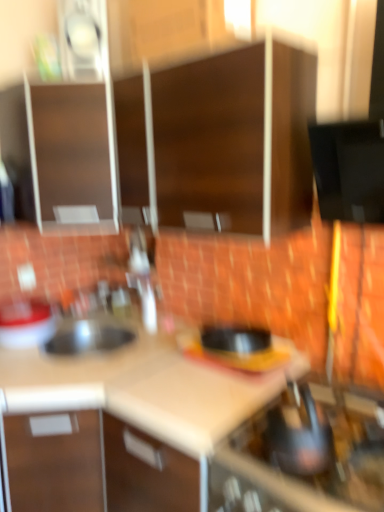
What do you see at coordinates (25, 324) in the screenshot? Image resolution: width=384 pixels, height=512 pixels. I see `matte white sink at left` at bounding box center [25, 324].

Find the location of a particular element. matte white sink at left is located at coordinates (25, 324).

What is the approximate width of beige laminate countertop at center?

It is 1.09 meters.

Describe the element at coordinates (176, 426) in the screenshot. The width and height of the screenshot is (384, 512). I see `beige laminate countertop at center` at that location.

Consider the image. What is the approximate width of wooden cabinet at center, which is the third cabinetry from left to right?

wooden cabinet at center, which is the third cabinetry from left to right, is 12.86 inches wide.

The image size is (384, 512). What do you see at coordinates (196, 396) in the screenshot?
I see `beige laminate counter top at center, marked as the 1th counter top in a right-to-left arrangement` at bounding box center [196, 396].

What is the approximate width of matte brown cabinet at upper left, the 1th cabinetry when ordered from left to right?

20.59 inches.

The width and height of the screenshot is (384, 512). What do you see at coordinates (304, 456) in the screenshot?
I see `metallic silver kettle at lower right` at bounding box center [304, 456].

The image size is (384, 512). Find the location of `matte white sink at left`. matte white sink at left is located at coordinates (x=25, y=324).

From a real-world perspective, is beige laminate counter top at center, which appears as the 2th counter top when viewed from the left, beneath matte brown cabinet at upper left, which appears as the third cabinetry when viewed from the right?

Yes.

Which of these two, beige laminate counter top at center, marked as the 1th counter top in a right-to-left arrangement, or matte brown cabinet at upper left, the 1th cabinetry when ordered from left to right, stands shorter?

With less height is matte brown cabinet at upper left, the 1th cabinetry when ordered from left to right.

Is beige laminate counter top at center, which appears as the 2th counter top when viewed from the left, aimed at matte brown cabinet at upper left, which appears as the third cabinetry when viewed from the right?

No, beige laminate counter top at center, which appears as the 2th counter top when viewed from the left, is not facing towards matte brown cabinet at upper left, which appears as the third cabinetry when viewed from the right.

Does beige laminate counter top at center, marked as the 1th counter top in a right-to-left arrangement, have a lesser width compared to matte brown cabinet at upper left, the 1th cabinetry when ordered from left to right?

No, beige laminate counter top at center, marked as the 1th counter top in a right-to-left arrangement, is not thinner than matte brown cabinet at upper left, the 1th cabinetry when ordered from left to right.

Can you confirm if beige laminate counter top at center, which appears as the 2th counter top when viewed from the left, is wider than metallic silver kettle at lower right?

Yes, beige laminate counter top at center, which appears as the 2th counter top when viewed from the left, is wider than metallic silver kettle at lower right.

Is beige laminate counter top at center, which appears as the 2th counter top when viewed from the left, not near metallic silver kettle at lower right?

beige laminate counter top at center, which appears as the 2th counter top when viewed from the left, is actually quite close to metallic silver kettle at lower right.

Is point (266, 388) closer to camera compared to point (340, 399)?

No, it is behind (340, 399).

Is beige laminate countertop at center inside wooden cabinet at center, which is the third cabinetry from left to right?

No, beige laminate countertop at center is not surrounded by wooden cabinet at center, which is the third cabinetry from left to right.

Is wooden cabinet at center, which is the third cabinetry from left to right, far from beige laminate countertop at center?

wooden cabinet at center, which is the third cabinetry from left to right, is actually quite close to beige laminate countertop at center.

From a real-world perspective, is wooden cabinet at center, arranged as the first cabinetry when viewed from the right, above or below beige laminate countertop at center?

wooden cabinet at center, arranged as the first cabinetry when viewed from the right, is situated higher than beige laminate countertop at center in the real world.

Can you confirm if wooden cabinet at center, which is the third cabinetry from left to right, is taller than beige laminate countertop at center?

No, wooden cabinet at center, which is the third cabinetry from left to right, is not taller than beige laminate countertop at center.

Is wooden cabinet at upper center, acting as the second cabinetry starting from the left, closer to camera compared to matte white sink at left?

That is True.

From the image's perspective, between wooden cabinet at upper center, arranged as the 2th cabinetry when viewed from the right, and matte white sink at left, which one is located above?

wooden cabinet at upper center, arranged as the 2th cabinetry when viewed from the right, from the image's perspective.

How different are the orientations of wooden cabinet at upper center, arranged as the 2th cabinetry when viewed from the right, and matte white sink at left in degrees?

90 degrees.

Is wooden cabinet at upper center, acting as the second cabinetry starting from the left, oriented away from matte white sink at left?

No, matte white sink at left is not at the back of wooden cabinet at upper center, acting as the second cabinetry starting from the left.

Could you tell me if beige laminate counter top at center, which appears as the 2th counter top when viewed from the left, is turned towards white matte countertop at center, which appears as the second counter top when viewed from the right?

No, beige laminate counter top at center, which appears as the 2th counter top when viewed from the left, is not aimed at white matte countertop at center, which appears as the second counter top when viewed from the right.

Which object is more forward, beige laminate counter top at center, marked as the 1th counter top in a right-to-left arrangement, or white matte countertop at center, arranged as the 1th counter top when viewed from the left?

beige laminate counter top at center, marked as the 1th counter top in a right-to-left arrangement, is more forward.

Does point (229, 385) lie in front of point (121, 338)?

Yes, it is.

Between beige laminate counter top at center, which appears as the 2th counter top when viewed from the left, and white matte countertop at center, which appears as the second counter top when viewed from the right, which one has larger width?

beige laminate counter top at center, which appears as the 2th counter top when viewed from the left.

From the image's perspective, is wooden cabinet at center, which is the third cabinetry from left to right, on wooden cabinet at upper center, arranged as the 2th cabinetry when viewed from the right?

No, from the image's perspective, wooden cabinet at center, which is the third cabinetry from left to right, is not on top of wooden cabinet at upper center, arranged as the 2th cabinetry when viewed from the right.

Locate an element on the screen. The width and height of the screenshot is (384, 512). the 1st cabinetry positioned above the wooden cabinet at center, which is the third cabinetry from left to right (from the image's perspective) is located at coordinates (200, 146).

Does wooden cabinet at center, arranged as the first cabinetry when viewed from the right, have a greater width compared to wooden cabinet at upper center, acting as the second cabinetry starting from the left?

In fact, wooden cabinet at center, arranged as the first cabinetry when viewed from the right, might be narrower than wooden cabinet at upper center, acting as the second cabinetry starting from the left.

In the image, is wooden cabinet at center, which is the third cabinetry from left to right, positioned in front of or behind wooden cabinet at upper center, arranged as the 2th cabinetry when viewed from the right?

wooden cabinet at center, which is the third cabinetry from left to right, is positioned farther from the viewer than wooden cabinet at upper center, arranged as the 2th cabinetry when viewed from the right.

Is white matte countertop at center, arranged as the 1th counter top when viewed from the left, next to beige laminate counter top at center, marked as the 1th counter top in a right-to-left arrangement?

No, white matte countertop at center, arranged as the 1th counter top when viewed from the left, is not next to beige laminate counter top at center, marked as the 1th counter top in a right-to-left arrangement.

What's the angular difference between white matte countertop at center, arranged as the 1th counter top when viewed from the left, and beige laminate counter top at center, marked as the 1th counter top in a right-to-left arrangement,'s facing directions?

The angle between the facing direction of white matte countertop at center, arranged as the 1th counter top when viewed from the left, and the facing direction of beige laminate counter top at center, marked as the 1th counter top in a right-to-left arrangement, is 4.7 degrees.

In terms of size, does white matte countertop at center, which appears as the second counter top when viewed from the right, appear bigger or smaller than beige laminate counter top at center, marked as the 1th counter top in a right-to-left arrangement?

In the image, white matte countertop at center, which appears as the second counter top when viewed from the right, appears to be smaller than beige laminate counter top at center, marked as the 1th counter top in a right-to-left arrangement.

The height and width of the screenshot is (512, 384). I want to click on counter top above the beige laminate counter top at center, marked as the 1th counter top in a right-to-left arrangement (from a real-world perspective), so click(x=78, y=365).

Locate an element on the screen. the 2nd cabinetry behind the beige laminate counter top at center, marked as the 1th counter top in a right-to-left arrangement is located at coordinates (66, 130).

Identify the location of home appliance that is above the beige laminate counter top at center, marked as the 1th counter top in a right-to-left arrangement (from the image's perspective). Image resolution: width=384 pixels, height=512 pixels. (304, 456).

When comparing their distances from white matte countertop at center, which appears as the second counter top when viewed from the right, does matte white sink at left or matte brown cabinet at upper left, which appears as the third cabinetry when viewed from the right, seem closer?

The object closer to white matte countertop at center, which appears as the second counter top when viewed from the right, is matte white sink at left.

Estimate the real-world distances between objects in this image. Which object is further from matte brown cabinet at upper left, the 1th cabinetry when ordered from left to right, wooden cabinet at upper center, acting as the second cabinetry starting from the left, or beige laminate countertop at center?

beige laminate countertop at center lies further to matte brown cabinet at upper left, the 1th cabinetry when ordered from left to right, than the other object.

Based on their spatial positions, is matte white sink at left or wooden cabinet at upper center, acting as the second cabinetry starting from the left, closer to beige laminate countertop at center?

matte white sink at left lies closer to beige laminate countertop at center than the other object.

When comparing their distances from wooden cabinet at center, which is the third cabinetry from left to right, does wooden cabinet at upper center, arranged as the 2th cabinetry when viewed from the right, or beige laminate countertop at center seem closer?

wooden cabinet at upper center, arranged as the 2th cabinetry when viewed from the right.

From the image, which object appears to be nearer to beige laminate counter top at center, which appears as the 2th counter top when viewed from the left, metallic silver kettle at lower right or wooden cabinet at upper center, arranged as the 2th cabinetry when viewed from the right?

metallic silver kettle at lower right is positioned closer to the anchor beige laminate counter top at center, which appears as the 2th counter top when viewed from the left.

Consider the image. From the image, which object appears to be nearer to matte brown cabinet at upper left, which appears as the third cabinetry when viewed from the right, beige laminate countertop at center or wooden cabinet at center, which is the third cabinetry from left to right?

The object closer to matte brown cabinet at upper left, which appears as the third cabinetry when viewed from the right, is wooden cabinet at center, which is the third cabinetry from left to right.

When comparing their distances from beige laminate countertop at center, does wooden cabinet at upper center, acting as the second cabinetry starting from the left, or beige laminate counter top at center, marked as the 1th counter top in a right-to-left arrangement, seem closer?

beige laminate counter top at center, marked as the 1th counter top in a right-to-left arrangement.

Considering their positions, is matte white sink at left positioned closer to white matte countertop at center, which appears as the second counter top when viewed from the right, than beige laminate counter top at center, which appears as the 2th counter top when viewed from the left?

matte white sink at left is positioned closer to the anchor white matte countertop at center, which appears as the second counter top when viewed from the right.

The height and width of the screenshot is (512, 384). I want to click on cabinetry between wooden cabinet at upper center, arranged as the 2th cabinetry when viewed from the right, and beige laminate countertop at center in the up-down direction, so click(236, 140).

Locate an element on the screen. counter top between wooden cabinet at upper center, arranged as the 2th cabinetry when viewed from the right, and beige laminate countertop at center from top to bottom is located at coordinates (78, 365).

Image resolution: width=384 pixels, height=512 pixels. I want to click on home appliance between wooden cabinet at center, arranged as the first cabinetry when viewed from the right, and beige laminate countertop at center, in the vertical direction, so click(304, 456).

Locate an element on the screen. The width and height of the screenshot is (384, 512). kitchen appliance between wooden cabinet at center, arranged as the first cabinetry when viewed from the right, and white matte countertop at center, which appears as the second counter top when viewed from the right, vertically is located at coordinates (25, 324).